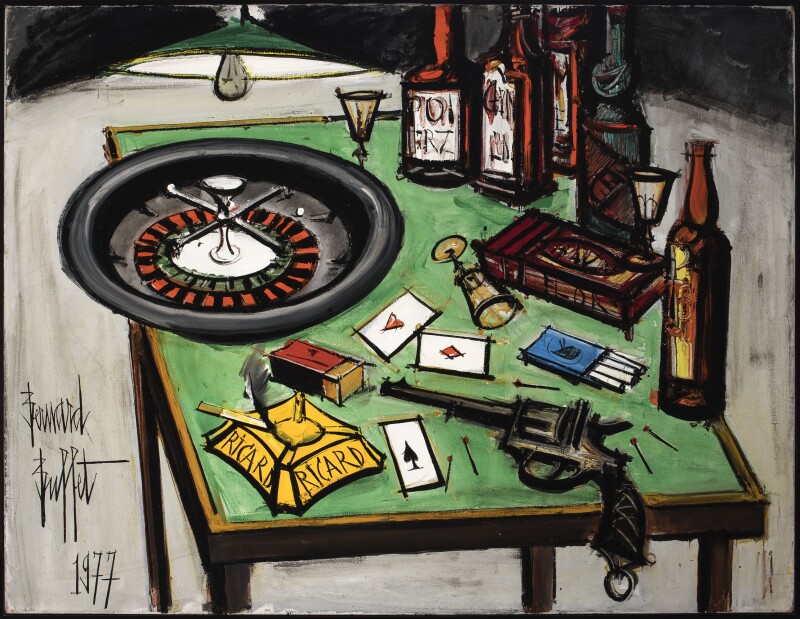
I want to click on bottle, so click(x=698, y=335).